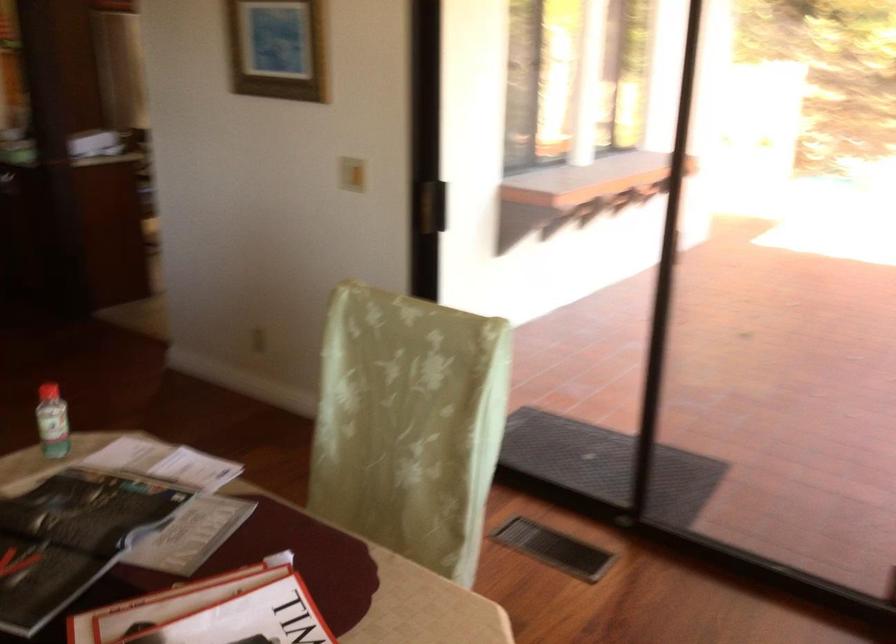
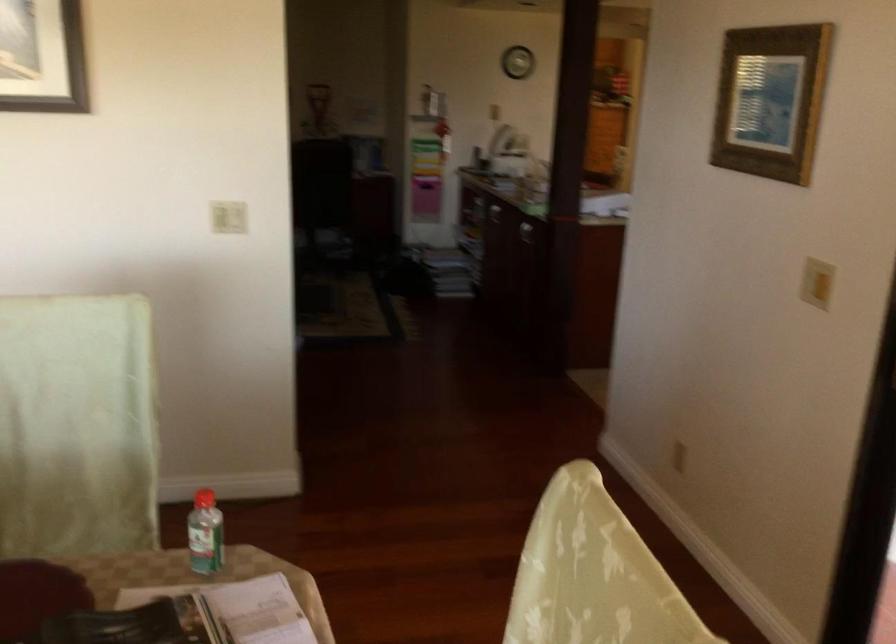
Find the pixel in the second image that matches point 354,162 in the first image.

(816, 283)